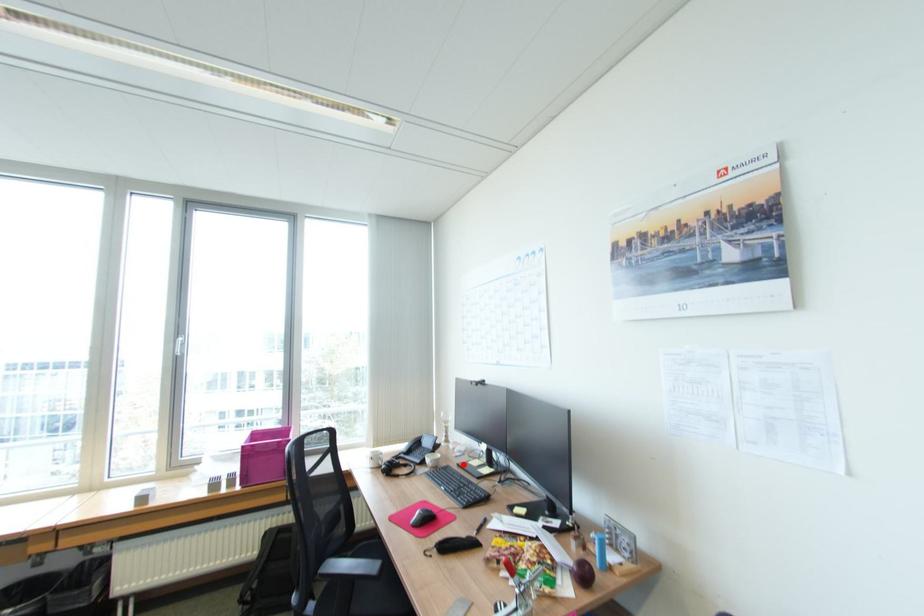
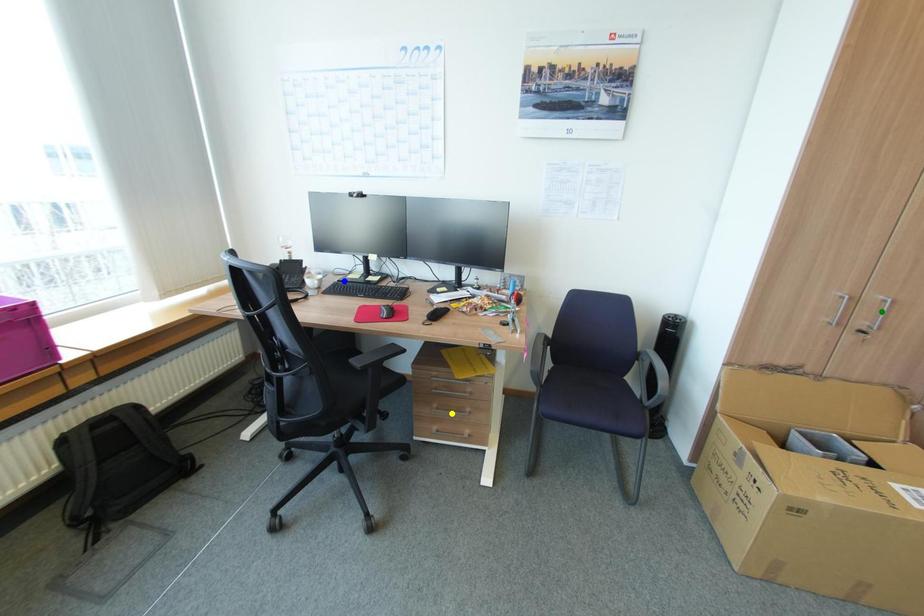
Question: I am providing you with two images of the same scene from different viewpoints. A red point is marked on the first image. You are given multiple points on the second image. Can you choose the point in image 2 that corresponds to the point in image 1?

Choices:
 (A) blue point
 (B) green point
 (C) yellow point

Answer: (A)